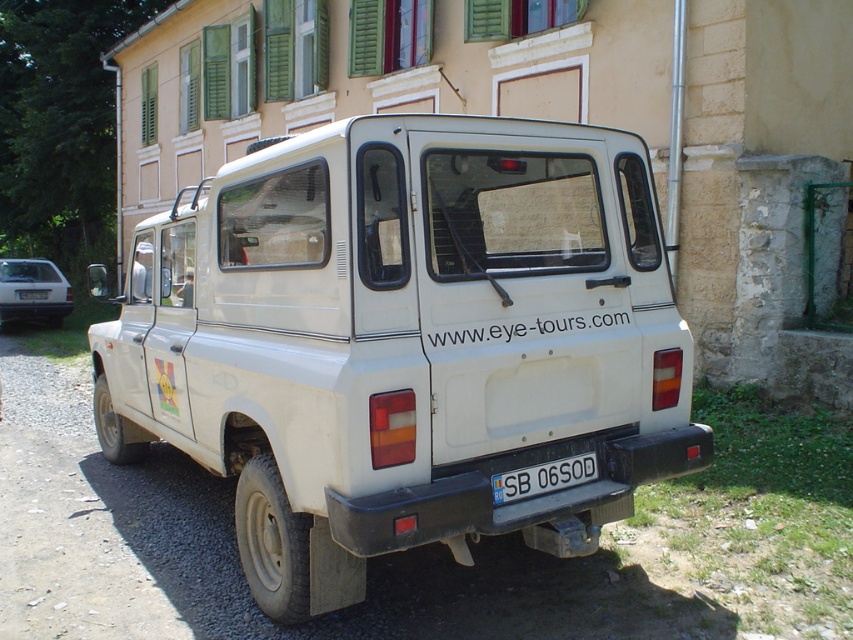
You are a photographer trying to capture a wide shot of the silver metallic sedan at left and the white plastic license plate at rear in the same frame. Given that the camera lens has a fixed focal length, which object should you position closer to the camera to ensure both fit in the frame?

To fit both the silver metallic sedan at left and the white plastic license plate at rear in the frame, position the silver metallic sedan at left closer to the camera since it is wider than the white plastic license plate at rear. This will help balance their sizes in the photograph.

Based on the photo, you are standing in front of the white off road vehicle and want to walk to the silver metallic sedan at left and the white plastic license plate at lower center. Which object will you reach first?

The silver metallic sedan at left is closer to you than the white plastic license plate at lower center, so you will reach the silver metallic sedan at left first.

You are a photographer taking a picture of the white plastic license plate at lower center and the white plastic license plate at rear. Which license plate will be more visible in the photo?

The white plastic license plate at lower center is in front of the white plastic license plate at rear, so the one at lower center will be more visible in the photo.